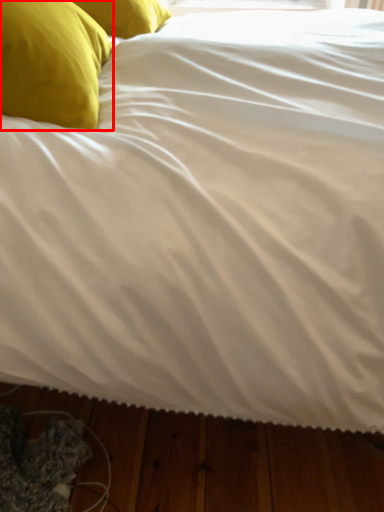
Question: In this image, where is pillow (annotated by the red box) located relative to pillow?

Choices:
 (A) left
 (B) right

Answer: (A)